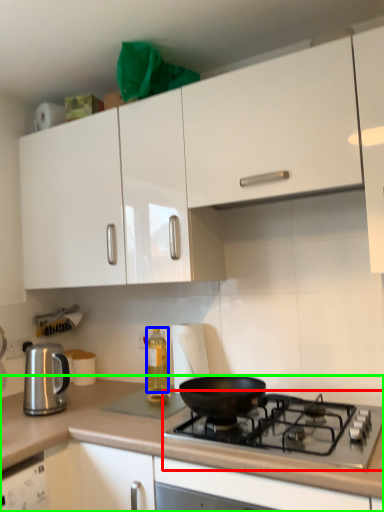
Question: Which object is the farthest from gas stove (highlighted by a red box)? Choose among these: bottle (highlighted by a blue box) or countertop (highlighted by a green box).

Choices:
 (A) bottle
 (B) countertop

Answer: (A)